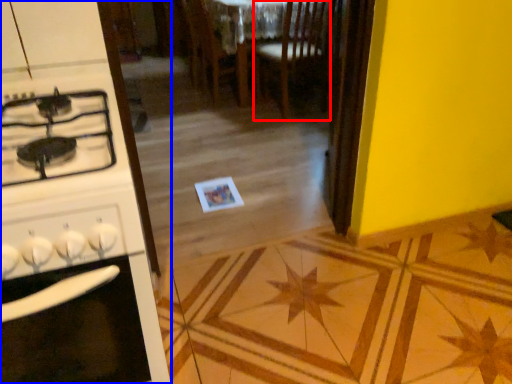
Question: Among these objects, which one is farthest to the camera, chair (highlighted by a red box) or kitchen appliance (highlighted by a blue box)?

Choices:
 (A) chair
 (B) kitchen appliance

Answer: (A)